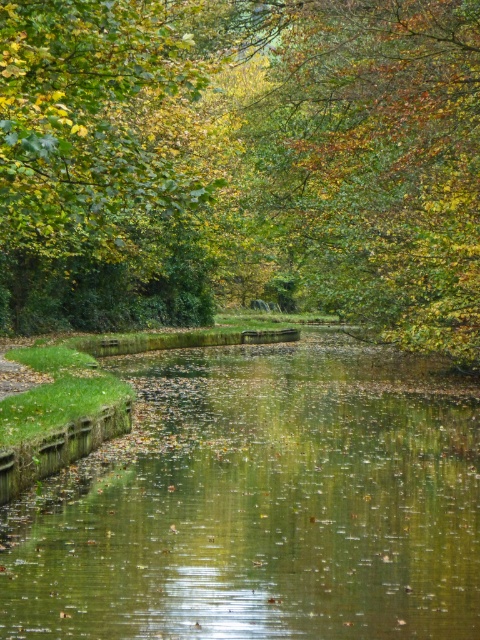
You are standing at the edge of the canal and want to take a photo of the green leafy tree at center. Which direction should you face to ensure the tree is in the center of your photo?

The green leafy tree at center is located at point coordinates, so you should face towards the center of the canal to capture it in the center of your photo.

You are standing on the grassy embankment on the left side of the canal. You see the green reflective water at center and the green leafy tree at upper center. Which object is located to the right of the other?

The green reflective water at center is positioned on the right side of green leafy tree at upper center.

You are standing on the grassy embankment on the left side of the canal. You see the green reflective water at center and the green leafy tree at upper center. Which object is closer to you?

The green reflective water at center is closer to you because it is in front of the green leafy tree at upper center.